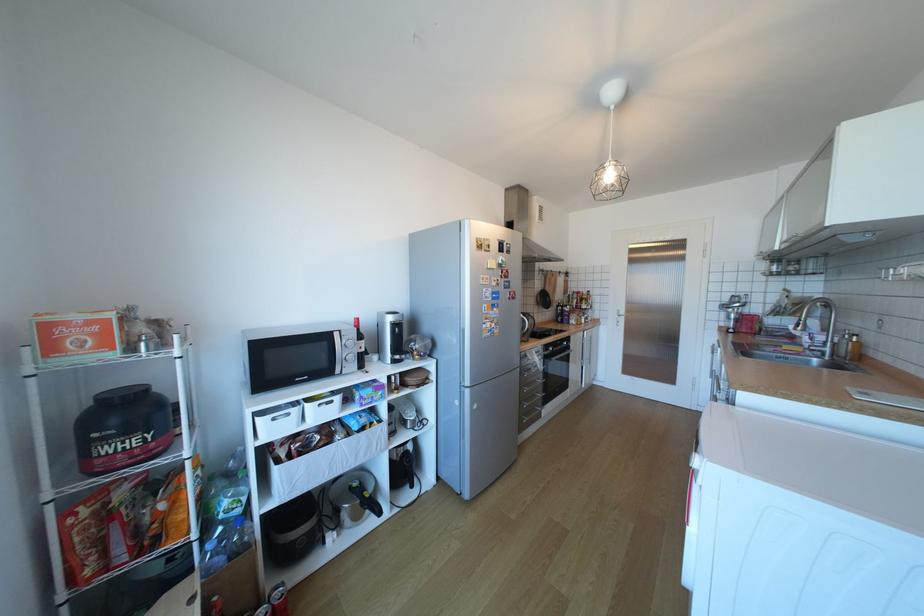
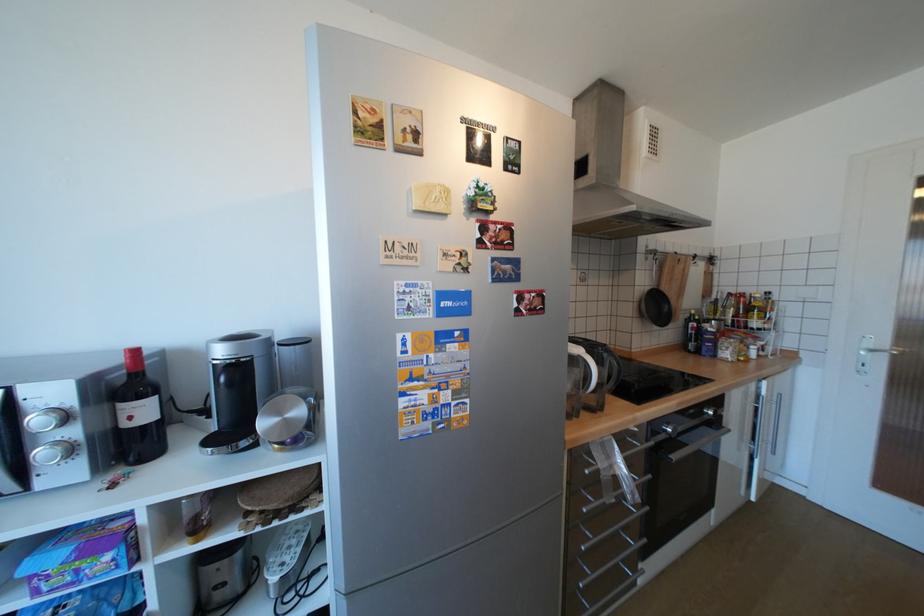
Locate, in the second image, the point that corresponds to (x=370, y=347) in the first image.

(140, 418)